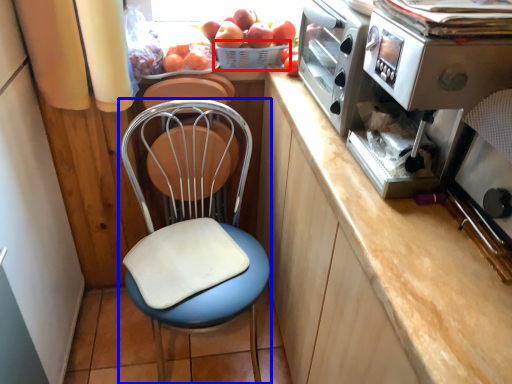
Question: Which point is further to the camera, basket (highlighted by a red box) or chair (highlighted by a blue box)?

Choices:
 (A) basket
 (B) chair

Answer: (A)